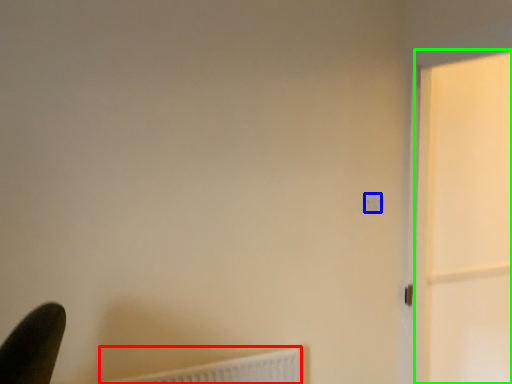
Question: Which object is positioned closest to radiator (highlighted by a red box)? Select from light switch (highlighted by a blue box) and screen door (highlighted by a green box).

Choices:
 (A) light switch
 (B) screen door

Answer: (A)